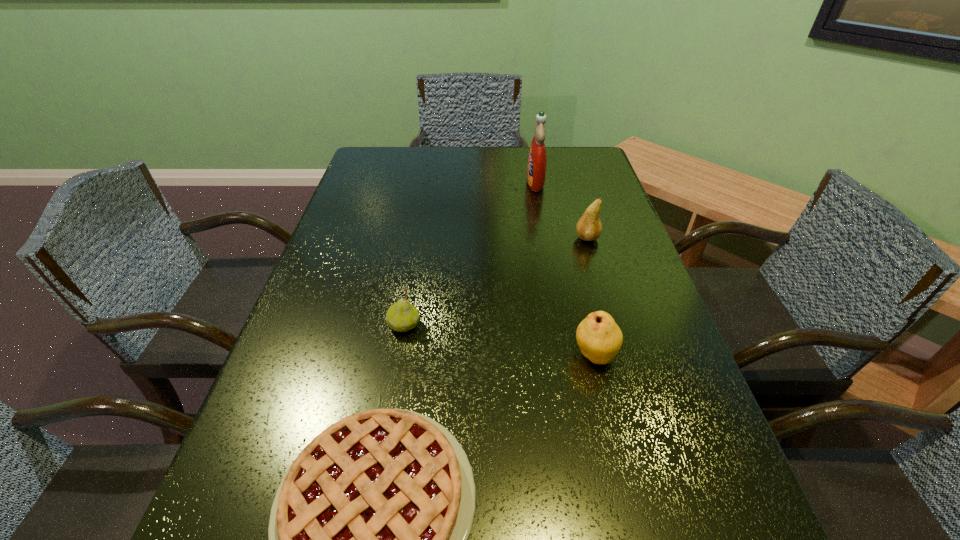
Locate an element on the screen. The height and width of the screenshot is (540, 960). free space that is in between the tallest object and the nearest pear is located at coordinates [564, 268].

Locate an element on the screen. The image size is (960, 540). vacant space that is in between the tallest object and the second nearest pear is located at coordinates (469, 254).

This screenshot has width=960, height=540. Identify the location of free space between the tallest object and the second farthest object. (562, 210).

The height and width of the screenshot is (540, 960). In order to click on empty location between the second farthest pear and the farthest pear in this screenshot , I will do `click(495, 282)`.

Where is `free space between the farthest pear and the tallest object`? free space between the farthest pear and the tallest object is located at coordinates (562, 210).

The height and width of the screenshot is (540, 960). In order to click on object that stands as the third closest to the leftmost pear in this screenshot , I will do `click(589, 227)`.

Locate an element on the screen. object identified as the third closest to the second farthest pear is located at coordinates (589, 227).

Select which pear is the third closest to the pie. Please provide its 2D coordinates. Your answer should be formatted as a tuple, i.e. [(x, y)], where the tuple contains the x and y coordinates of a point satisfying the conditions above.

[(589, 227)]

Identify which pear is located as the nearest to the third nearest object. Please provide its 2D coordinates. Your answer should be formatted as a tuple, i.e. [(x, y)], where the tuple contains the x and y coordinates of a point satisfying the conditions above.

[(600, 339)]

This screenshot has width=960, height=540. Find the location of `free location that satisfies the following two spatial constraints: 1. on the back side of the farthest pear; 2. on the left side of the leftmost pear`. free location that satisfies the following two spatial constraints: 1. on the back side of the farthest pear; 2. on the left side of the leftmost pear is located at coordinates (420, 238).